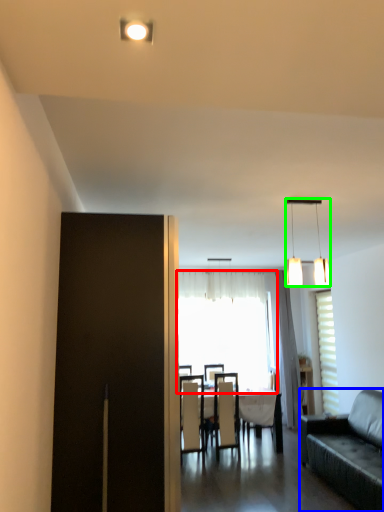
Question: Based on their relative distances, which object is nearer to window (highlighted by a red box)? Choose from studio couch (highlighted by a blue box) and lamp (highlighted by a green box).

Choices:
 (A) studio couch
 (B) lamp

Answer: (A)